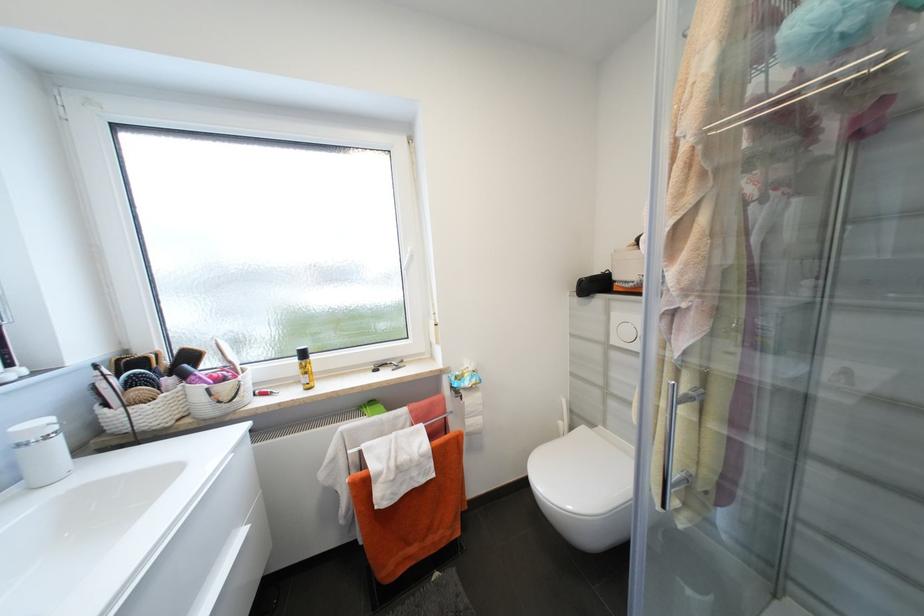
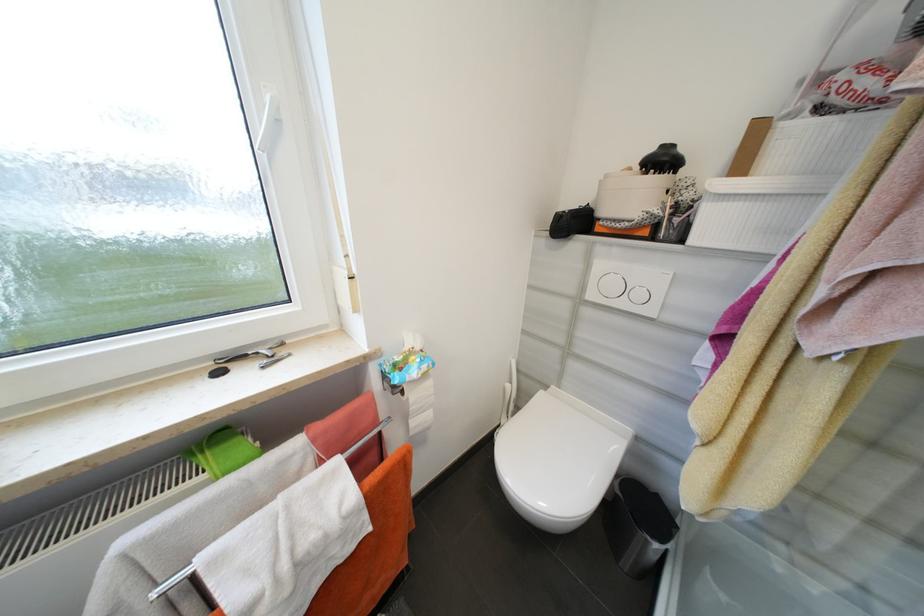
The point at (587, 283) is marked in the first image. Where is the corresponding point in the second image?

(565, 217)